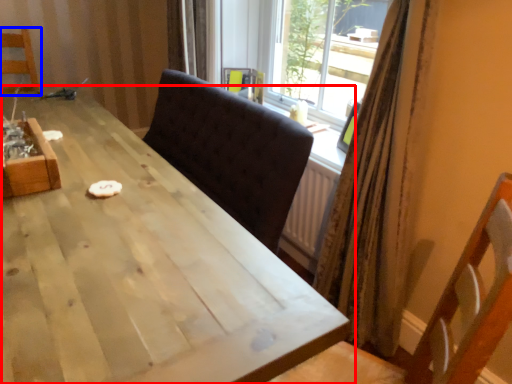
Question: Which point is closer to the camera, table (highlighted by a red box) or chair (highlighted by a blue box)?

Choices:
 (A) table
 (B) chair

Answer: (A)